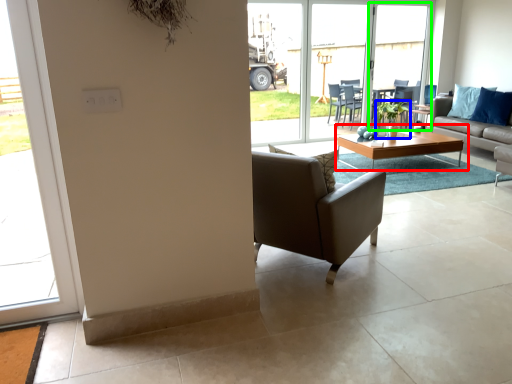
Question: Considering the real-world distances, which object is closest to coffee table (highlighted by a red box)? houseplant (highlighted by a blue box) or screen door (highlighted by a green box).

Choices:
 (A) houseplant
 (B) screen door

Answer: (A)